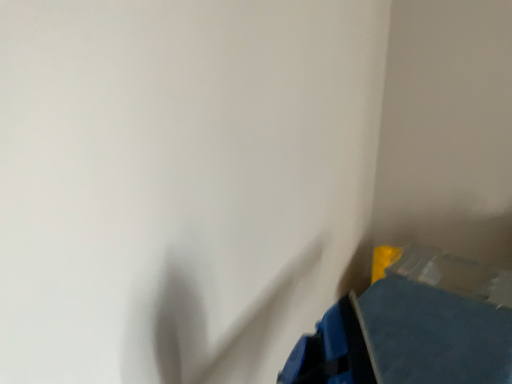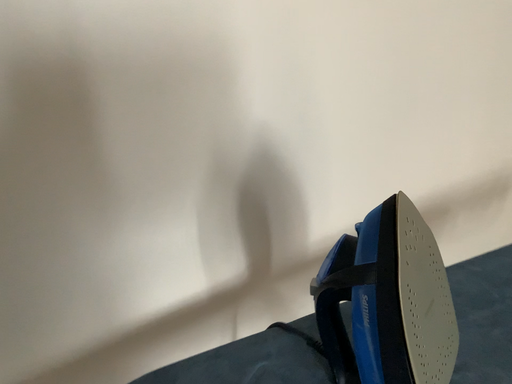
Question: How did the camera likely rotate when shooting the video?

Choices:
 (A) rotated downward
 (B) rotated upward

Answer: (A)